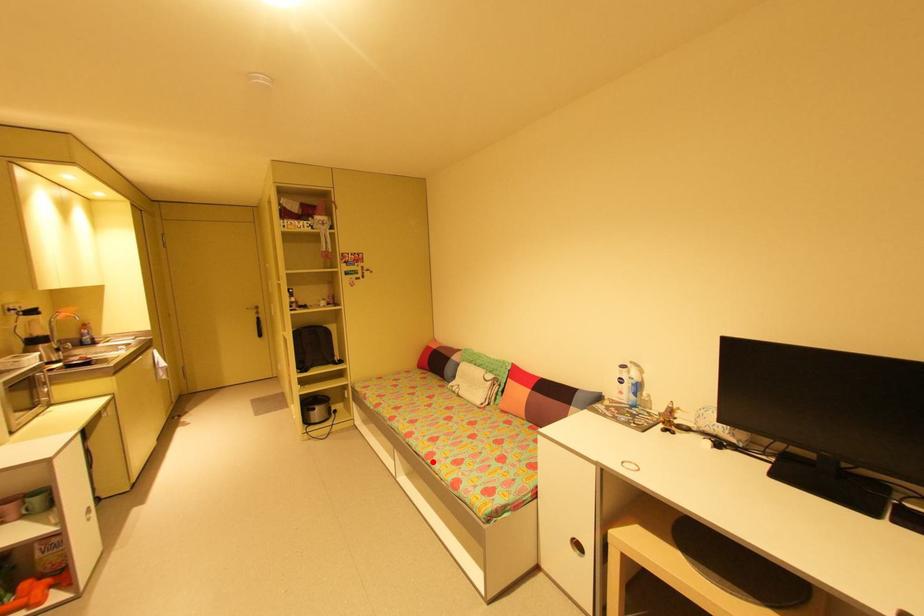
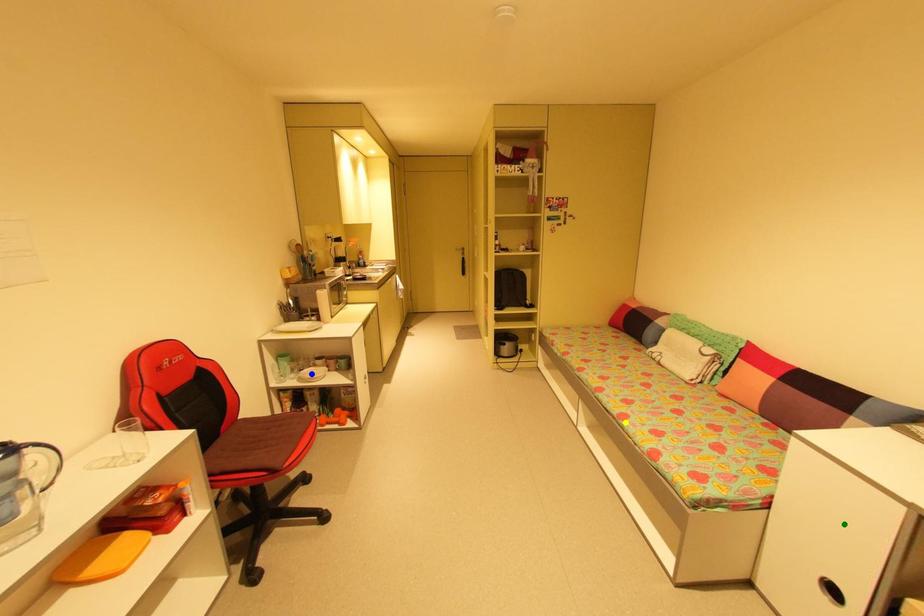
Question: I am providing you with two images of the same scene from different viewpoints. A red point is marked on the first image. You are given multiple points on the second image. Which mark in image 2 goes with the point in image 1?

Choices:
 (A) green point
 (B) blue point
 (C) yellow point

Answer: (C)